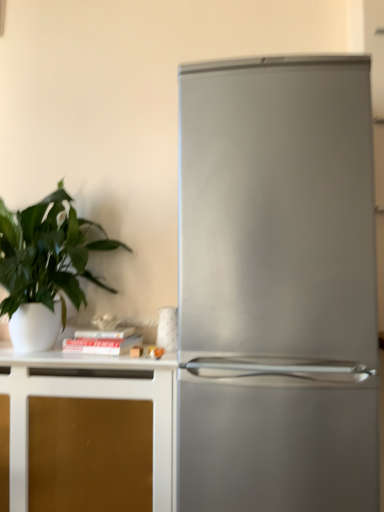
Question: From the image's perspective, is gold matte cabinet at lower left located above or below green matte plant at left?

Choices:
 (A) above
 (B) below

Answer: (B)

Question: Relative to green matte plant at left, is gold matte cabinet at lower left in front or behind?

Choices:
 (A) front
 (B) behind

Answer: (B)

Question: Considering the real-world distances, which object is farthest from the green matte plant at left?

Choices:
 (A) gold matte cabinet at lower left
 (B) stainless steel refrigerator at right

Answer: (B)

Question: Estimate the real-world distances between objects in this image. Which object is closer to the green matte plant at left?

Choices:
 (A) gold matte cabinet at lower left
 (B) stainless steel refrigerator at right

Answer: (A)